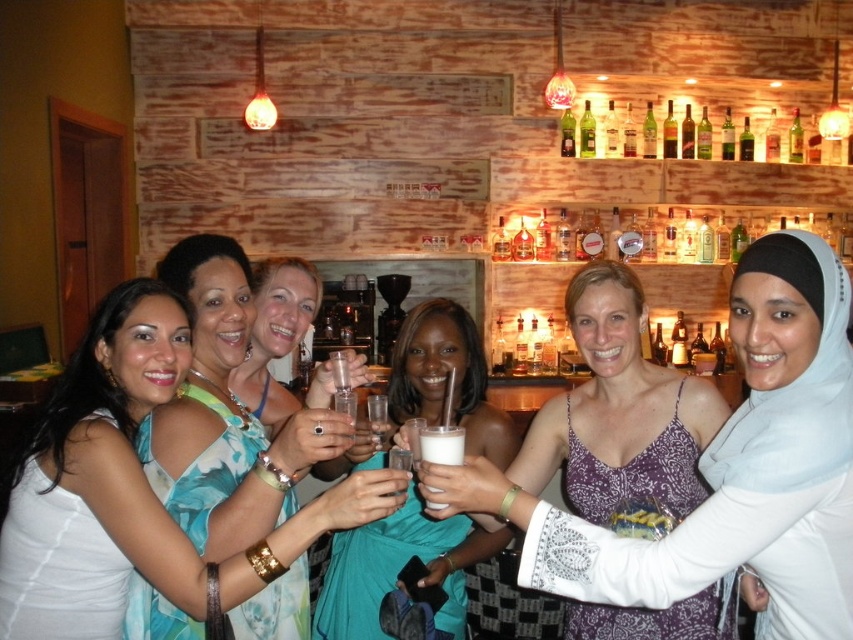
Question: Which object is farther from the camera taking this photo?

Choices:
 (A) white fabric dress at center
 (B) teal floral dress at center
 (C) white frothy liquid at center
 (D) clear glass at center

Answer: (D)

Question: Which point appears farthest from the camera in this image?

Choices:
 (A) (775, 136)
 (B) (358, 548)

Answer: (A)

Question: Is white frothy liquid at center thinner than green glass bottle at upper right?

Choices:
 (A) no
 (B) yes

Answer: (A)

Question: Which point appears closest to the camera in this image?

Choices:
 (A) (97, 420)
 (B) (457, 440)

Answer: (A)

Question: Can you confirm if white lace dress at center is positioned to the right of translucent glass bottle at center?

Choices:
 (A) no
 (B) yes

Answer: (A)

Question: Is teal floral dress at center thinner than teal satin dress at center?

Choices:
 (A) no
 (B) yes

Answer: (B)